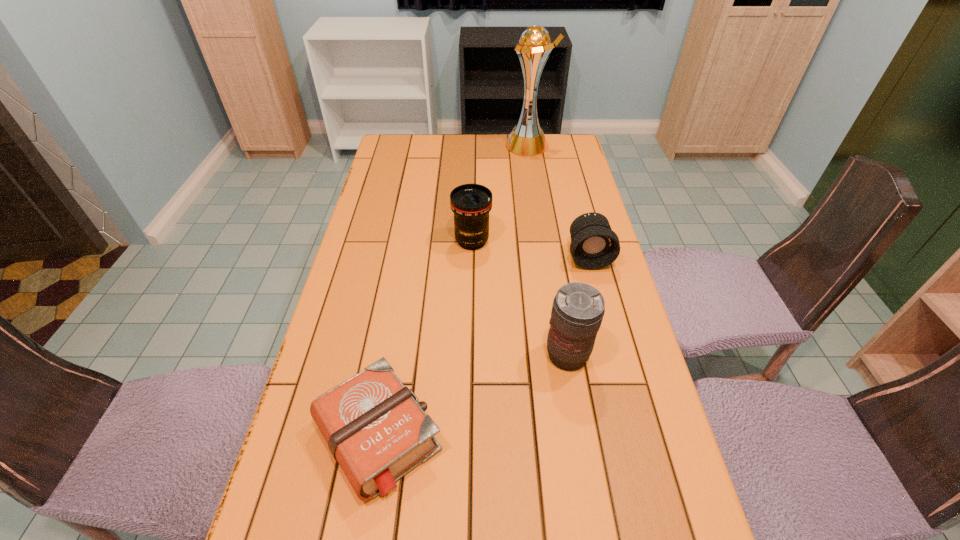
Locate an element on the screen. Image resolution: width=960 pixels, height=540 pixels. the farthest object is located at coordinates (527, 138).

Image resolution: width=960 pixels, height=540 pixels. Identify the location of the tallest object. (527, 138).

Find the location of `the tallest telephoto lens`. the tallest telephoto lens is located at coordinates (578, 308).

Where is `the fourth shortest object`? The image size is (960, 540). the fourth shortest object is located at coordinates (578, 308).

Identify the location of the second tallest telephoto lens. The image size is (960, 540). (471, 203).

Identify the location of the leftmost telephoto lens. This screenshot has width=960, height=540. coord(471,203).

Where is `the shortest telephoto lens`? the shortest telephoto lens is located at coordinates (594, 245).

Where is `Bible`? Bible is located at coordinates click(376, 429).

Find the location of a particular element. the shortest object is located at coordinates (376, 429).

Where is `vacant point located on the front-facing side of the farthest object`? Image resolution: width=960 pixels, height=540 pixels. vacant point located on the front-facing side of the farthest object is located at coordinates (478, 145).